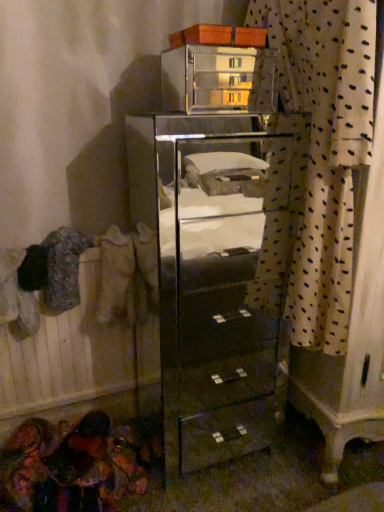
Where is `free space underneath clear glass cabinet at center (from a real-world perspective)`? free space underneath clear glass cabinet at center (from a real-world perspective) is located at coordinates (219, 440).